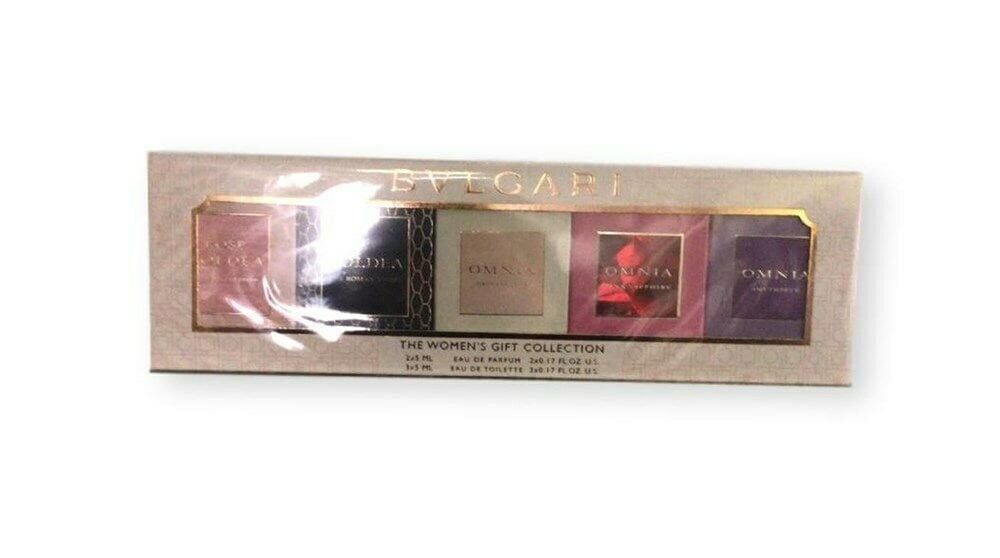
Image resolution: width=1000 pixels, height=558 pixels. What are the coordinates of `box` in the screenshot? It's located at (761, 327).